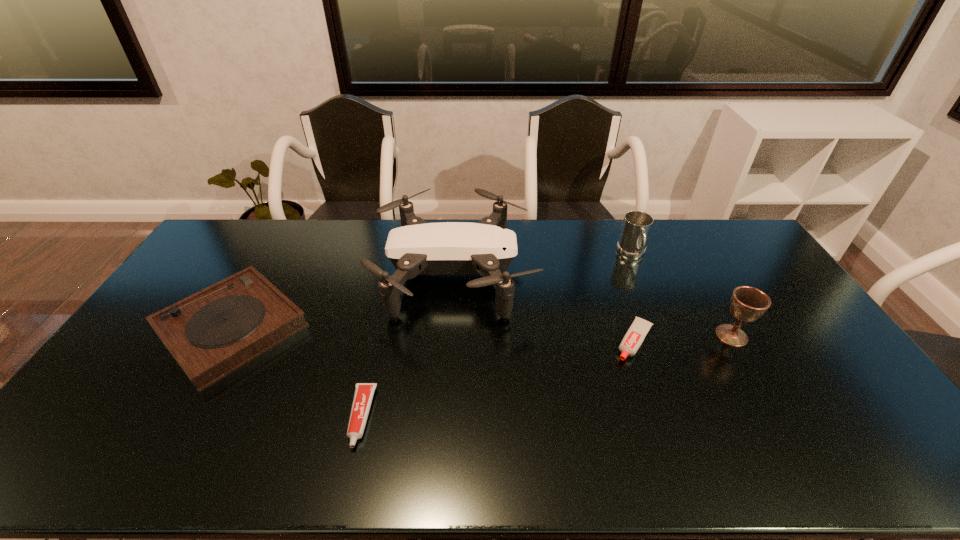
Locate an element on the screen. Image resolution: width=960 pixels, height=540 pixels. vacant space at the right edge of the desktop is located at coordinates (748, 276).

Identify the location of free location at the far left corner of the desktop. (256, 222).

I want to click on vacant region at the far right corner, so (x=723, y=238).

Where is `vacant space that's between the chalice and the mug`? This screenshot has height=540, width=960. vacant space that's between the chalice and the mug is located at coordinates (682, 295).

This screenshot has width=960, height=540. In order to click on free space between the fourth tallest object and the mug in this screenshot , I will do `click(432, 291)`.

This screenshot has height=540, width=960. I want to click on vacant space in between the mug and the left toothpaste, so click(496, 336).

In order to click on free point between the chalice and the leftmost object in this screenshot , I will do `click(482, 332)`.

Image resolution: width=960 pixels, height=540 pixels. Find the location of `empty space that is in between the third shortest object and the mug`. empty space that is in between the third shortest object and the mug is located at coordinates (432, 291).

Where is `free spot between the mug and the farther toothpaste`? free spot between the mug and the farther toothpaste is located at coordinates pyautogui.click(x=634, y=298).

Where is `vacant space in between the drone and the nearer toothpaste`? vacant space in between the drone and the nearer toothpaste is located at coordinates (408, 346).